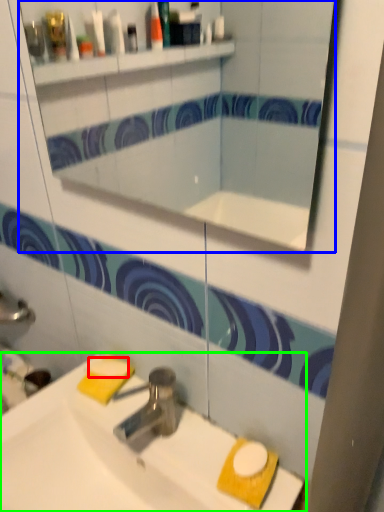
Question: Based on their relative distances, which object is nearer to soap (highlighted by a red box)? Choose from mirror (highlighted by a blue box) and sink (highlighted by a green box).

Choices:
 (A) mirror
 (B) sink

Answer: (B)